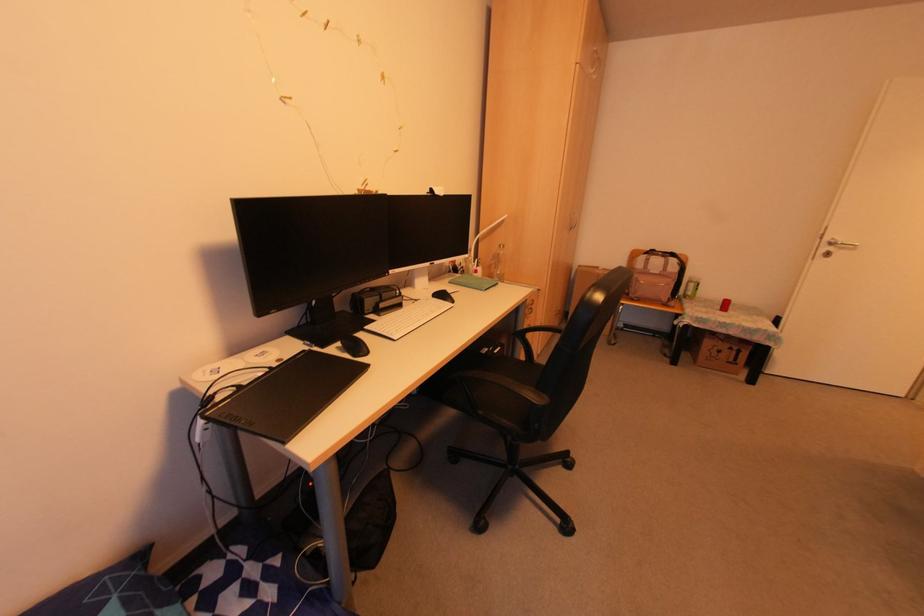
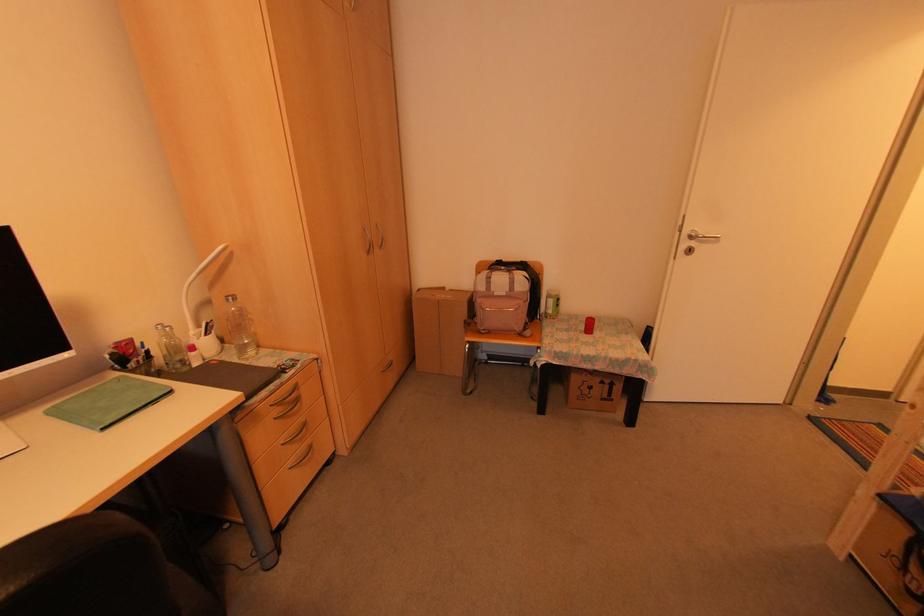
Find the pixel in the second image that matches the point at 825,254 in the first image.

(687, 251)